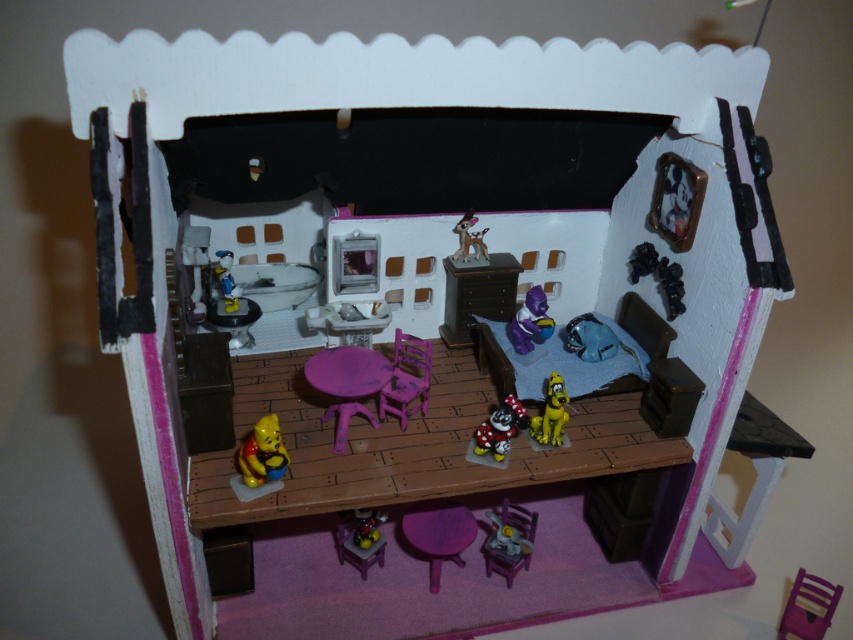
Can you confirm if purple plastic chair at center is smaller than metallic silver figurine at center?

No.

Can you confirm if purple plastic chair at center is wider than metallic silver figurine at center?

Yes, purple plastic chair at center is wider than metallic silver figurine at center.

Where is `purple plastic chair at center`? This screenshot has width=853, height=640. purple plastic chair at center is located at coordinates (509, 540).

What do you see at coordinates (347, 381) in the screenshot? The image size is (853, 640). I see `purple plastic table at center` at bounding box center [347, 381].

Is point (338, 442) positioned behind point (473, 212)?

No, (338, 442) is closer to viewer.

Is point (323, 349) farther from viewer compared to point (459, 220)?

No.

Where is `purple plastic table at center`? This screenshot has width=853, height=640. purple plastic table at center is located at coordinates (347, 381).

Who is more forward, (537,518) or (798,605)?

Positioned in front is point (798,605).

Can you confirm if purple plastic chair at center is positioned below purple plastic chair at lower right?

Actually, purple plastic chair at center is above purple plastic chair at lower right.

Find the location of a particular element. This screenshot has height=640, width=853. purple plastic chair at center is located at coordinates (509, 540).